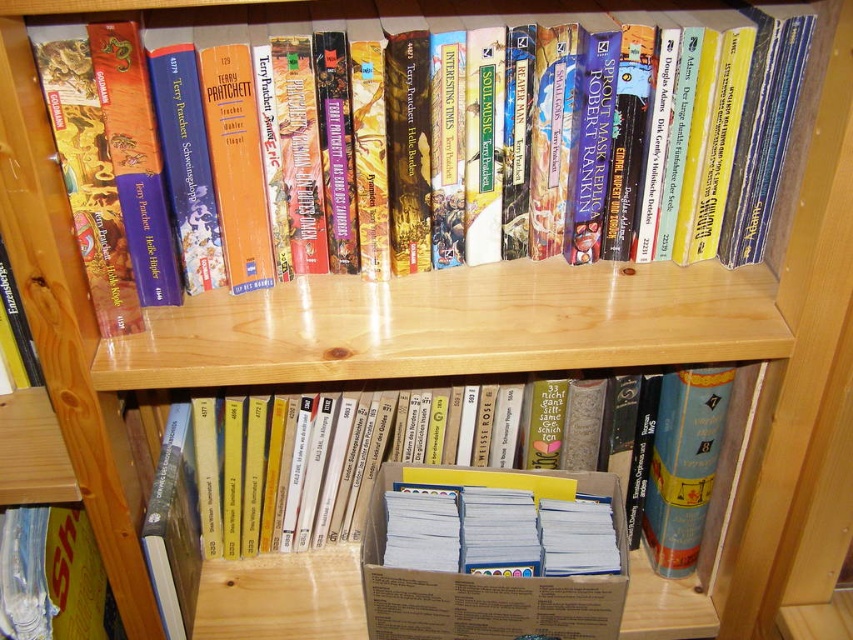
Question: Which of the following is the farthest from the observer?

Choices:
 (A) (200, 620)
 (B) (712, 108)

Answer: (A)

Question: Which object appears farthest from the camera in this image?

Choices:
 (A) hardcover book at upper center
 (B) brown cardboard box at center

Answer: (B)

Question: Can you confirm if brown cardboard box at center is positioned to the right of hardcover book at upper center?

Choices:
 (A) yes
 (B) no

Answer: (A)

Question: Does brown cardboard box at center have a larger size compared to hardcover book at upper center?

Choices:
 (A) no
 (B) yes

Answer: (A)

Question: Is brown cardboard box at center in front of hardcover book at upper center?

Choices:
 (A) yes
 (B) no

Answer: (B)